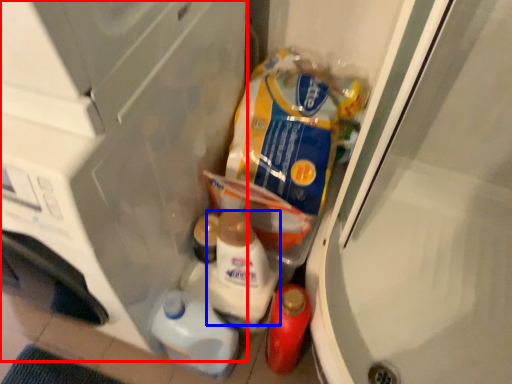
Question: Which object is closer to the camera taking this photo, appliance (highlighted by a red box) or snack (highlighted by a blue box)?

Choices:
 (A) appliance
 (B) snack

Answer: (A)